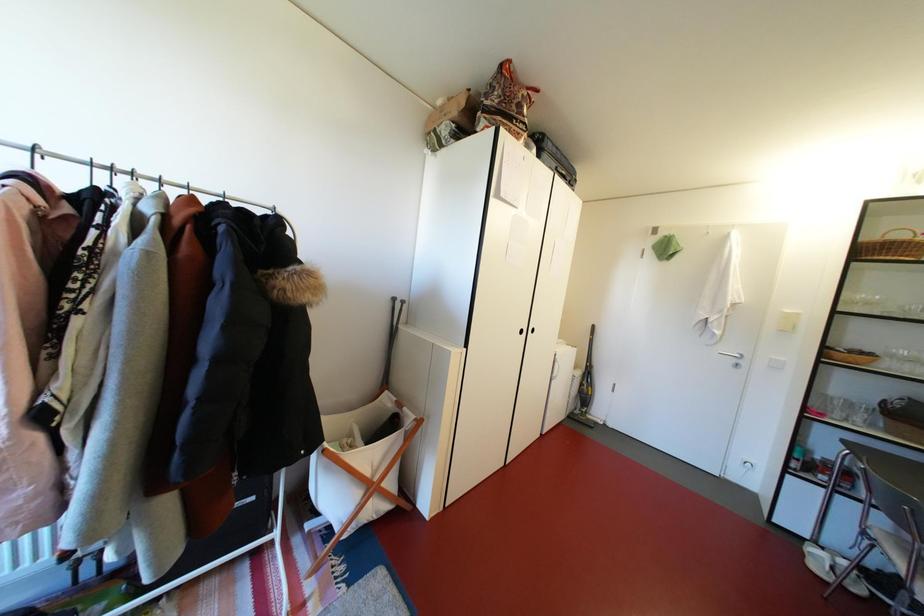
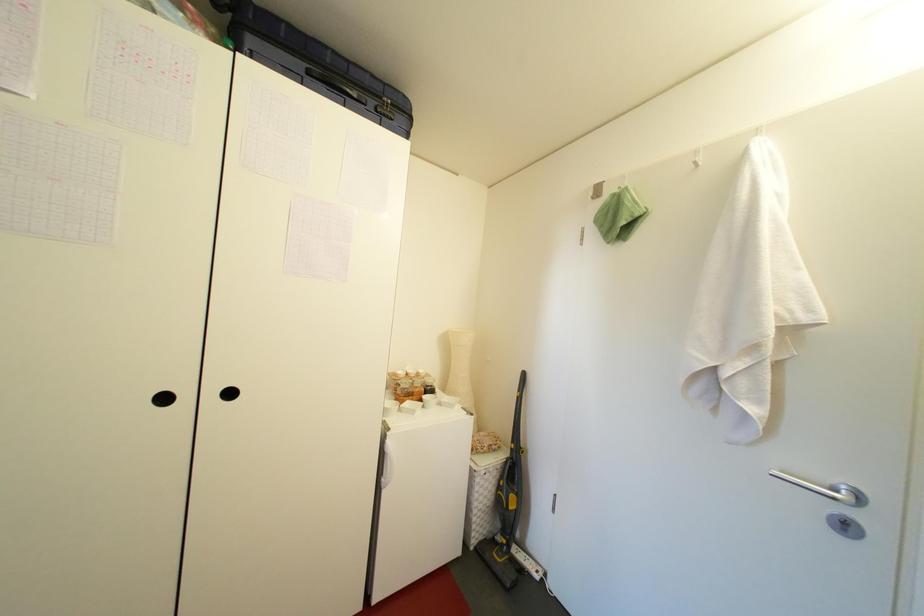
Which direction would the cameraman need to move to produce the second image?

The movement direction of the cameraman is right, forward.